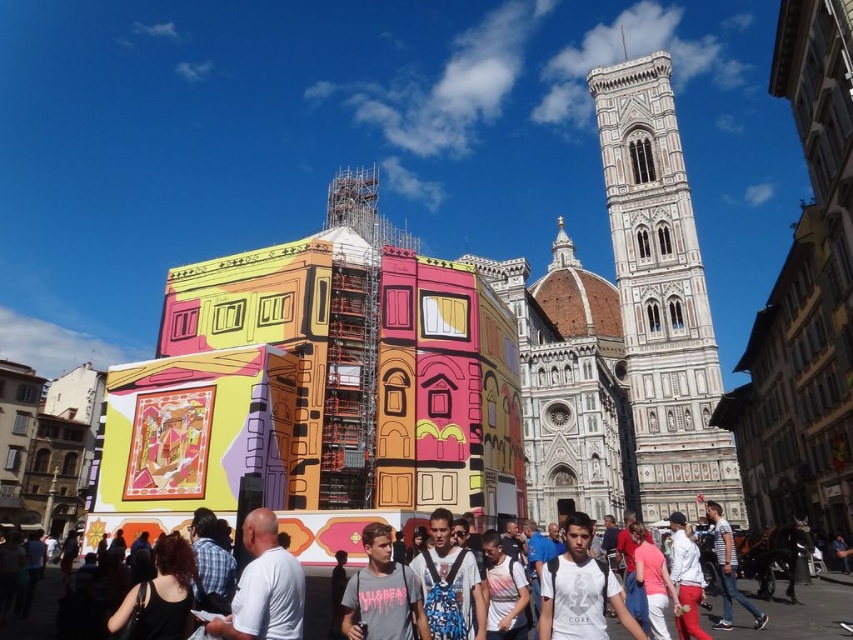
Question: Which point is farther to the camera?

Choices:
 (A) pink cotton shirt at center
 (B) dark brown hair at lower left

Answer: (A)

Question: Which point is closer to the camera taking this photo?

Choices:
 (A) (112, 634)
 (B) (682, 618)
 (C) (669, 410)

Answer: (A)

Question: Is the position of white marble tower at center more distant than that of white matte shirt at center?

Choices:
 (A) yes
 (B) no

Answer: (A)

Question: Does white marble tower at center have a greater width compared to white matte shirt at center?

Choices:
 (A) no
 (B) yes

Answer: (B)

Question: Which object appears farthest from the camera in this image?

Choices:
 (A) pink cotton shirt at center
 (B) white matte shirt at center
 (C) white cotton t-shirt at center
 (D) dark brown hair at lower left

Answer: (C)

Question: Does white cotton t-shirt at center appear under white matte shirt at center?

Choices:
 (A) yes
 (B) no

Answer: (B)